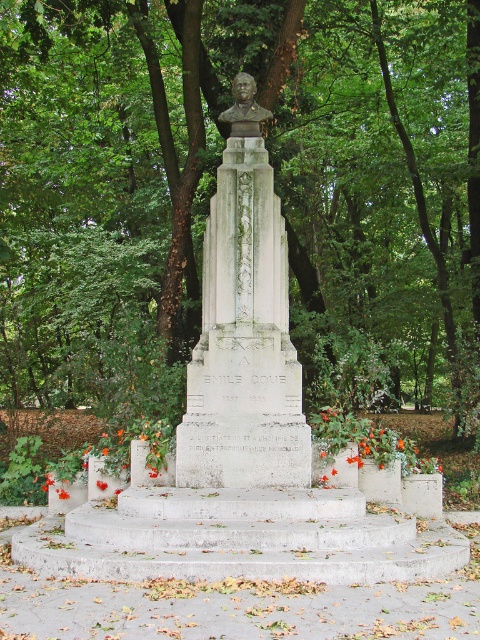
You are a landscape architect planning to add a new pathway around the monument. Given the green leafy tree at center and the matte bronze bust at center, which object requires more space on either side to accommodate its width?

The green leafy tree at center requires more space on either side because its width is larger than the matte bronze bust at center.

You are a landscape architect planning to install a new lighting system around the monument. The lighting must ensure the matte bronze bust at center is clearly visible under the green leafy tree at center. Given the tree is larger, what adjustment should be made to the lighting setup?

Since the green leafy tree at center is larger in size than the matte bronze bust at center, the lighting should be adjusted to focus more illumination on the matte bronze bust at center to ensure it stands out against the tree.